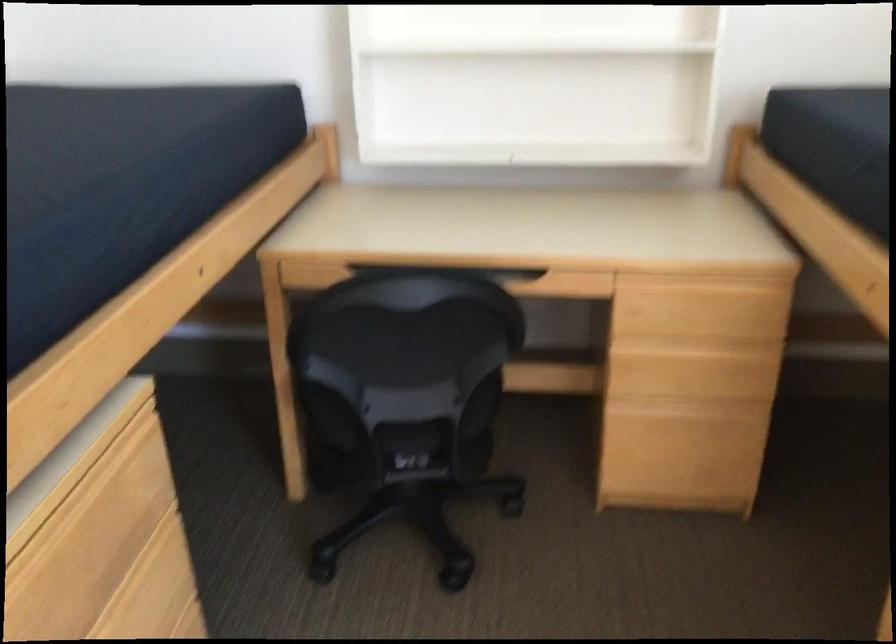
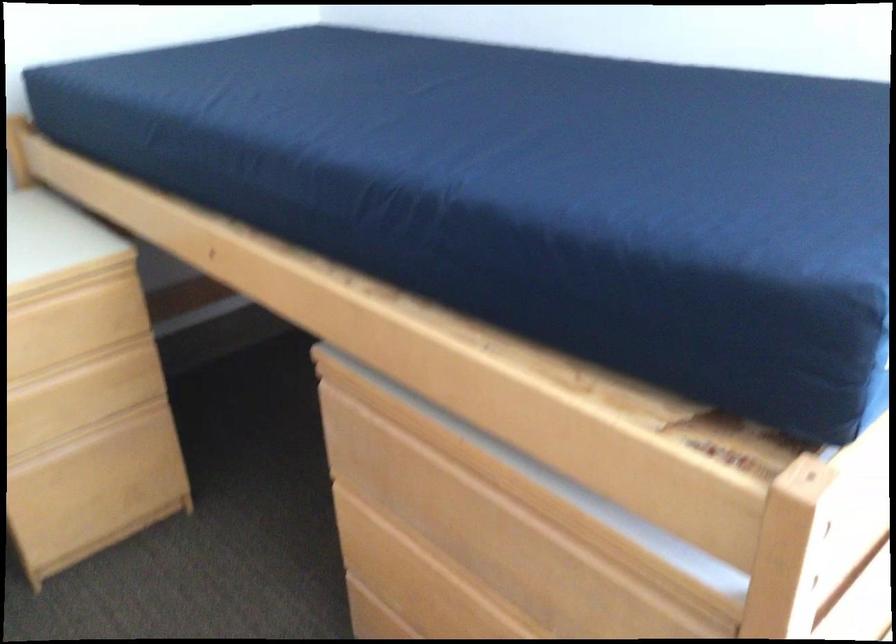
Question: The images are taken continuously from a first-person perspective. In which direction is your viewpoint rotating?

Choices:
 (A) Left
 (B) Right
 (C) Up
 (D) Down

Answer: (B)